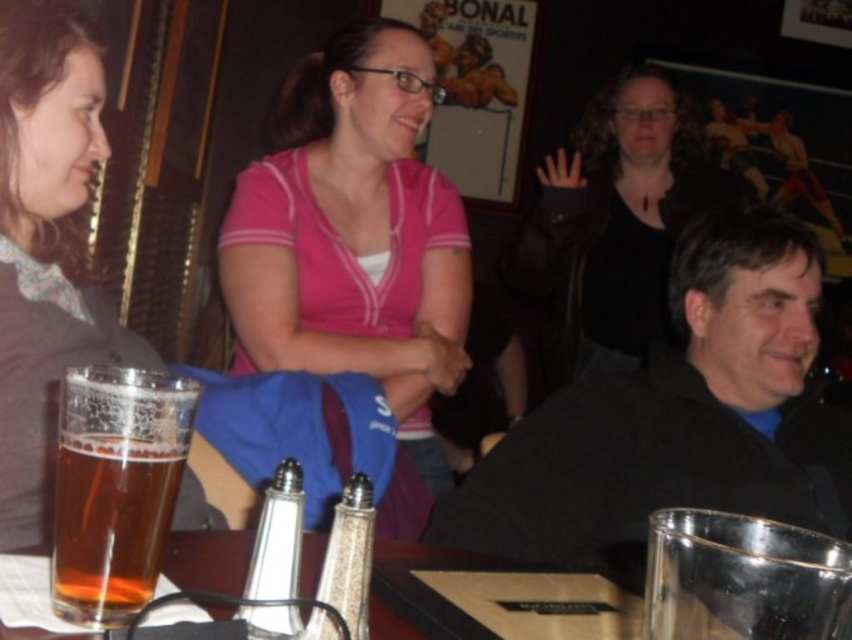
Can you confirm if black matte jacket at center is positioned to the right of matte black jacket at upper center?

No, black matte jacket at center is not to the right of matte black jacket at upper center.

Does black matte jacket at center appear on the left side of matte black jacket at upper center?

Correct, you'll find black matte jacket at center to the left of matte black jacket at upper center.

Image resolution: width=852 pixels, height=640 pixels. What do you see at coordinates (678, 417) in the screenshot?
I see `black matte jacket at center` at bounding box center [678, 417].

Where is `black matte jacket at center`? black matte jacket at center is located at coordinates (678, 417).

Can you confirm if matte black jacket at upper center is positioned to the left of translucent glass at lower left?

Incorrect, matte black jacket at upper center is not on the left side of translucent glass at lower left.

The image size is (852, 640). What do you see at coordinates (619, 218) in the screenshot?
I see `matte black jacket at upper center` at bounding box center [619, 218].

Describe the element at coordinates (619, 218) in the screenshot. The width and height of the screenshot is (852, 640). I see `matte black jacket at upper center` at that location.

Where is `matte black jacket at upper center`? matte black jacket at upper center is located at coordinates (619, 218).

Does point (672, 492) come closer to viewer compared to point (96, 568)?

No, it is behind (96, 568).

Can you confirm if black matte jacket at center is wider than translucent glass at lower left?

Indeed, black matte jacket at center has a greater width compared to translucent glass at lower left.

Locate an element on the screen. Image resolution: width=852 pixels, height=640 pixels. black matte jacket at center is located at coordinates (678, 417).